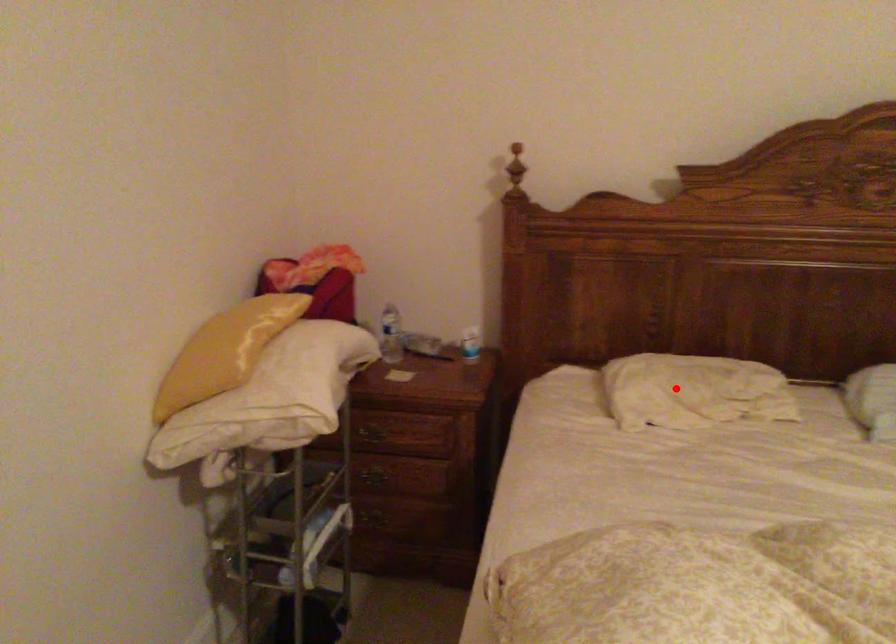
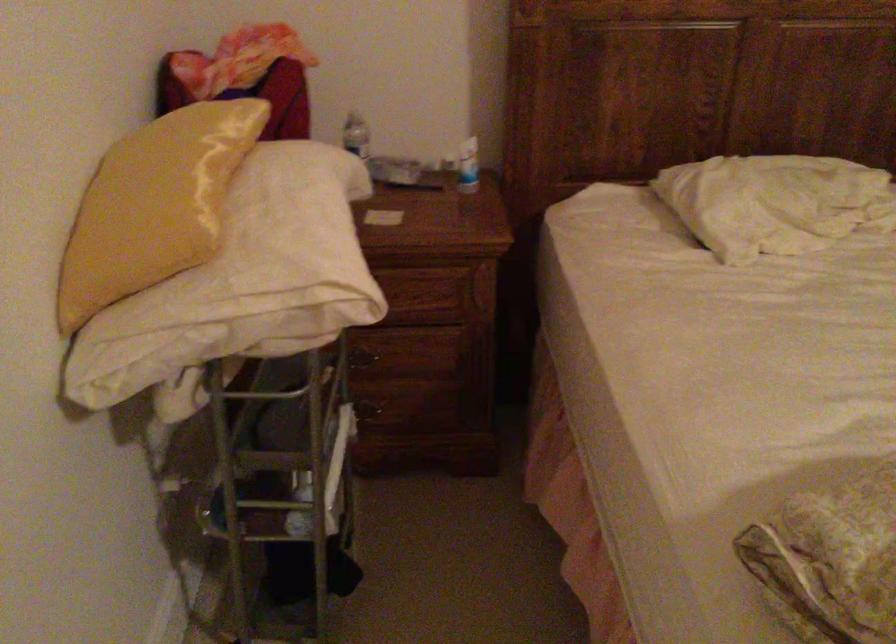
Question: I am providing you with two images of the same scene from different viewpoints. A red point is shown in image1. For the corresponding object point in image2, is it positioned nearer or farther from the camera?

Choices:
 (A) Nearer
 (B) Farther

Answer: (A)